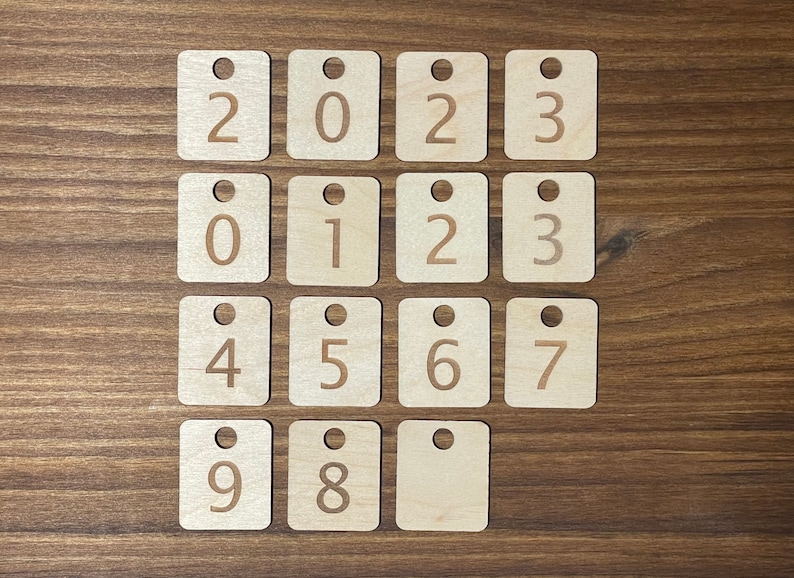
The height and width of the screenshot is (578, 794). What are the coordinates of `table` in the screenshot? It's located at (95, 186).